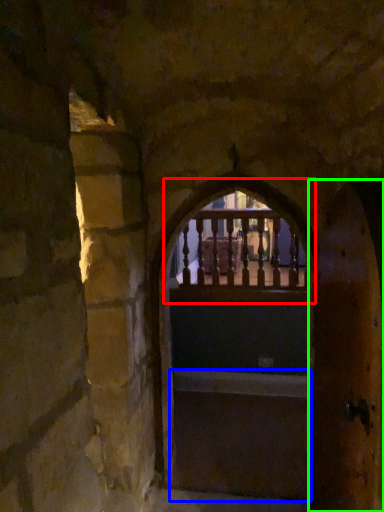
Question: Based on their relative distances, which object is farther from window (highlighted by a red box)? Choose from stairs (highlighted by a blue box) and door (highlighted by a green box).

Choices:
 (A) stairs
 (B) door

Answer: (B)